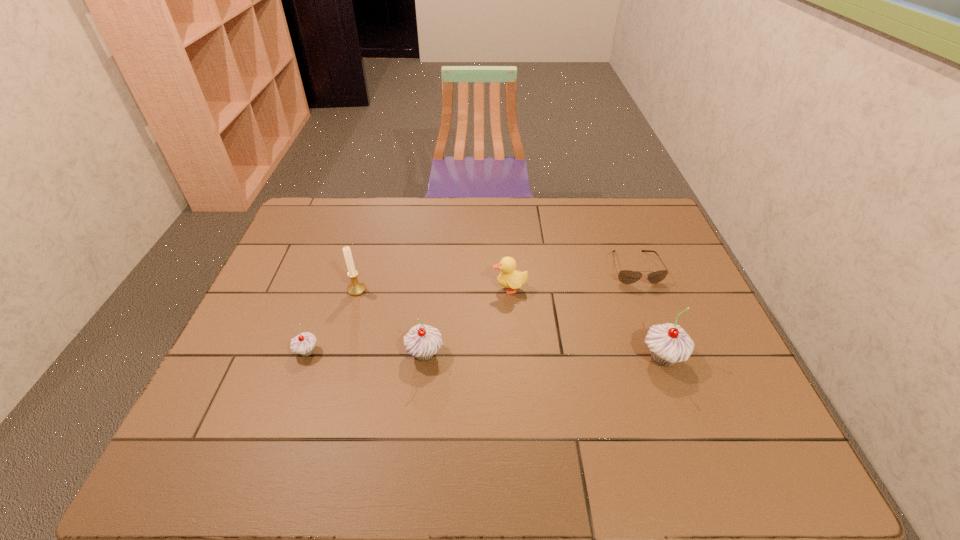
Identify the location of vacant region that satisfies the following two spatial constraints: 1. on the front side of the second cupcake from left to right; 2. on the right side of the rightmost cupcake. (424, 357).

I want to click on free spot that satisfies the following two spatial constraints: 1. on the front-facing side of the sunglasses; 2. on the front-facing side of the duckling, so click(x=642, y=288).

Locate an element on the screen. free spot that satisfies the following two spatial constraints: 1. on the front-facing side of the duckling; 2. on the front side of the candle holder is located at coordinates (510, 289).

The image size is (960, 540). What are the coordinates of `free region that satisfies the following two spatial constraints: 1. on the front-facing side of the sunglasses; 2. on the front-facing side of the third object from right to left` in the screenshot? It's located at (642, 288).